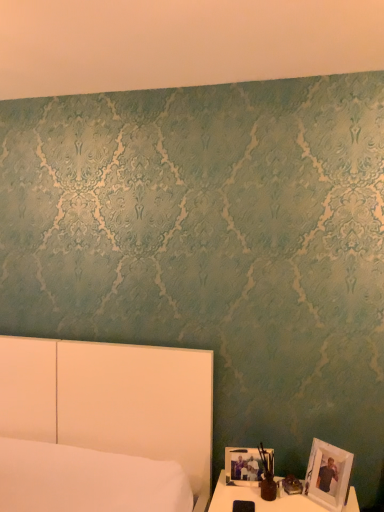
Locate an element on the screen. The image size is (384, 512). free spot to the right of matte brown vase at lower right is located at coordinates (293, 502).